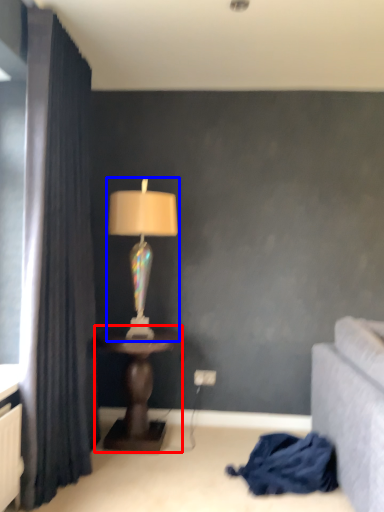
Question: Which object appears closest to the camera in this image, table (highlighted by a red box) or lamp (highlighted by a blue box)?

Choices:
 (A) table
 (B) lamp

Answer: (A)